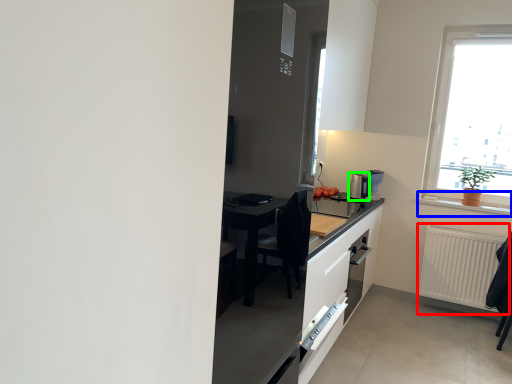
Question: Considering the real-world distances, which object is farthest from radiator (highlighted by a red box)? window sill (highlighted by a blue box) or coffee machine (highlighted by a green box)?

Choices:
 (A) window sill
 (B) coffee machine

Answer: (B)